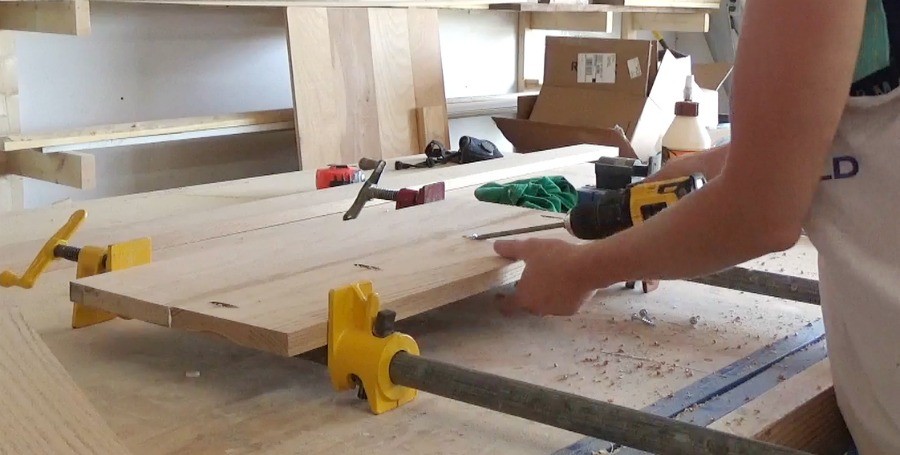
I want to click on shelf, so click(541, 7).